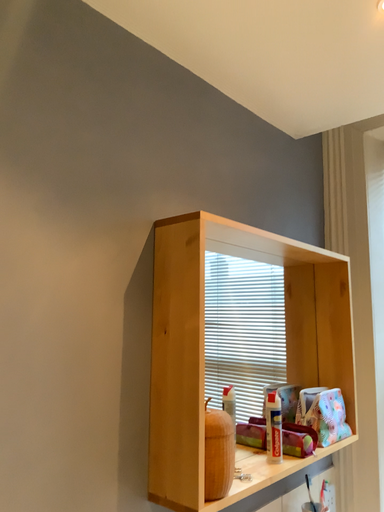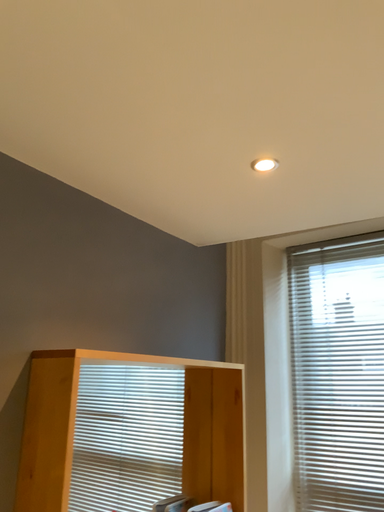
Question: How did the camera likely rotate when shooting the video?

Choices:
 (A) rotated downward
 (B) rotated upward

Answer: (B)